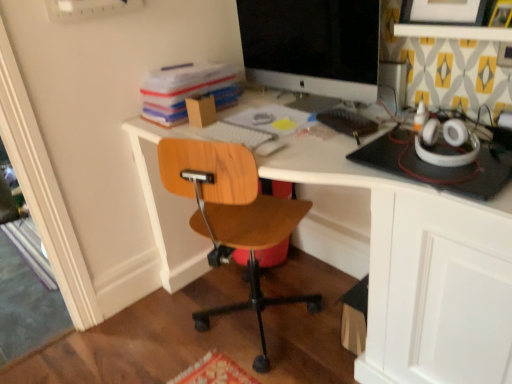
Question: Is white glossy desk at center taller than matte black picture frame at upper right?

Choices:
 (A) yes
 (B) no

Answer: (A)

Question: From a real-world perspective, is white glossy desk at center under matte black picture frame at upper right?

Choices:
 (A) yes
 (B) no

Answer: (A)

Question: Considering the relative sizes of white glossy desk at center and matte black picture frame at upper right in the image provided, is white glossy desk at center shorter than matte black picture frame at upper right?

Choices:
 (A) yes
 (B) no

Answer: (B)

Question: Can you confirm if white glossy desk at center is thinner than matte black picture frame at upper right?

Choices:
 (A) no
 (B) yes

Answer: (A)

Question: Is there a large distance between white glossy desk at center and matte black picture frame at upper right?

Choices:
 (A) yes
 (B) no

Answer: (B)

Question: Does white glossy desk at center lie in front of matte black picture frame at upper right?

Choices:
 (A) no
 (B) yes

Answer: (B)

Question: Can you confirm if stacked paperboard at upper left is taller than satin black monitor at upper center?

Choices:
 (A) yes
 (B) no

Answer: (B)

Question: Is satin black monitor at upper center inside stacked paperboard at upper left?

Choices:
 (A) yes
 (B) no

Answer: (B)

Question: Can you confirm if stacked paperboard at upper left is positioned to the left of satin black monitor at upper center?

Choices:
 (A) yes
 (B) no

Answer: (A)

Question: Is stacked paperboard at upper left shorter than satin black monitor at upper center?

Choices:
 (A) no
 (B) yes

Answer: (B)

Question: Does stacked paperboard at upper left have a lesser width compared to satin black monitor at upper center?

Choices:
 (A) no
 (B) yes

Answer: (A)

Question: Can you confirm if stacked paperboard at upper left is positioned to the right of satin black monitor at upper center?

Choices:
 (A) no
 (B) yes

Answer: (A)

Question: Is white glossy desk at center placed right next to satin black monitor at upper center?

Choices:
 (A) no
 (B) yes

Answer: (A)